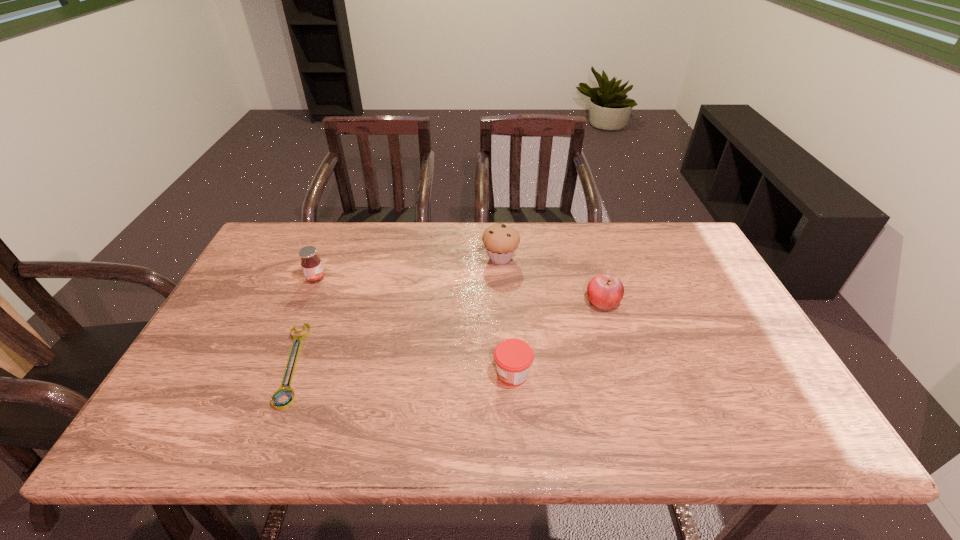
Find the location of a particular element. This screenshot has width=960, height=540. the farthest object is located at coordinates (501, 242).

The height and width of the screenshot is (540, 960). Identify the location of the farther jam. (311, 264).

Find the location of a particular element. the fourth nearest object is located at coordinates (311, 264).

This screenshot has width=960, height=540. Find the location of `the rightmost object`. the rightmost object is located at coordinates (604, 291).

At what (x,y) coordinates should I click in order to perform the action: click on the third nearest object. Please return your answer as a coordinate pair (x, y). The image size is (960, 540). Looking at the image, I should click on (604, 291).

Locate an element on the screen. This screenshot has height=540, width=960. the second shortest object is located at coordinates (513, 357).

Locate an element on the screen. The height and width of the screenshot is (540, 960). the nearer jam is located at coordinates (513, 357).

Identify the location of the shortest object. (281, 391).

Where is `vacant space located 0.090m on the back of the muffin`? Image resolution: width=960 pixels, height=540 pixels. vacant space located 0.090m on the back of the muffin is located at coordinates (499, 231).

This screenshot has height=540, width=960. Identify the location of free spot located on the label side of the farther jam. (436, 279).